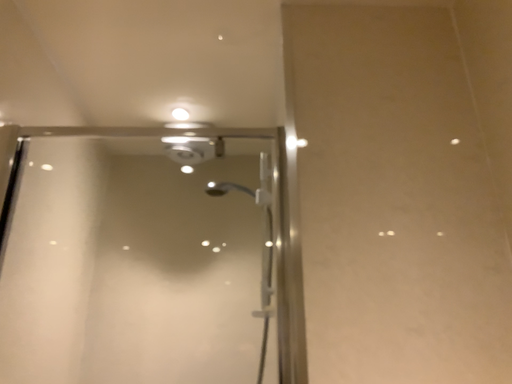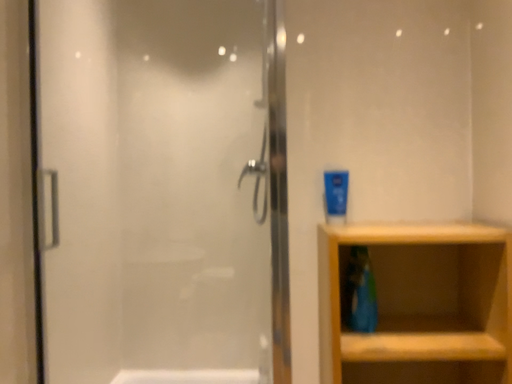
Question: How did the camera likely rotate when shooting the video?

Choices:
 (A) rotated downward
 (B) rotated upward

Answer: (A)